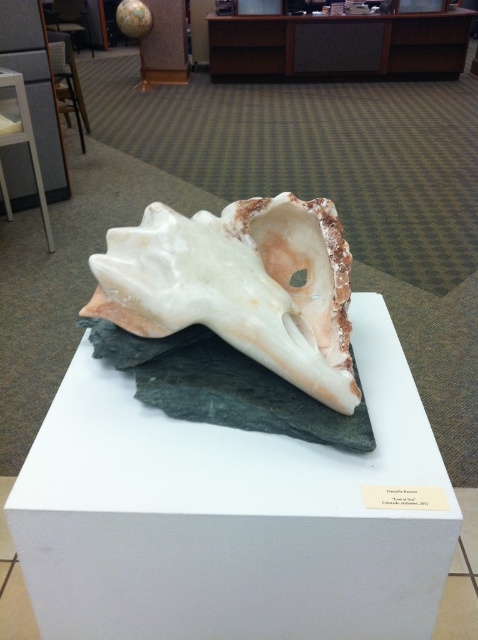
You are an art conservator examining the sculpture. You notice that the white matte shell at center is positioned behind the white matte stone at center. Which object would you need to move first to access the one behind it?

The white matte stone at center is closer to the viewer than the white matte shell at center. To access the white matte shell at center, you would need to move the white matte stone at center first.

You are an art conservator assessing the sculpture. You need to determine if the white matte shell at center is securely attached to the white matte stone at center. Based on their sizes, which object is more likely to provide a stable base for the other?

The white matte stone at center is larger in size than the white matte shell at center, so the white matte stone at center is more likely to provide a stable base for the white matte shell at center due to its larger size.